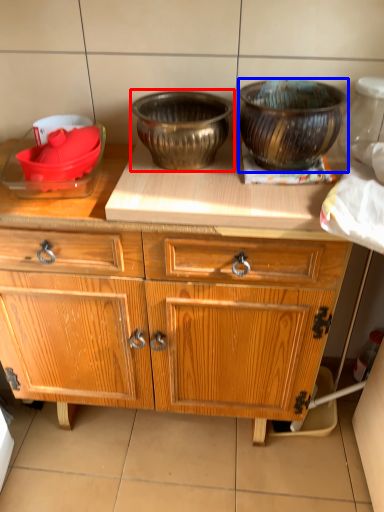
Question: Which point is further to the camera, bowl (highlighted by a red box) or bowl (highlighted by a blue box)?

Choices:
 (A) bowl
 (B) bowl

Answer: (A)